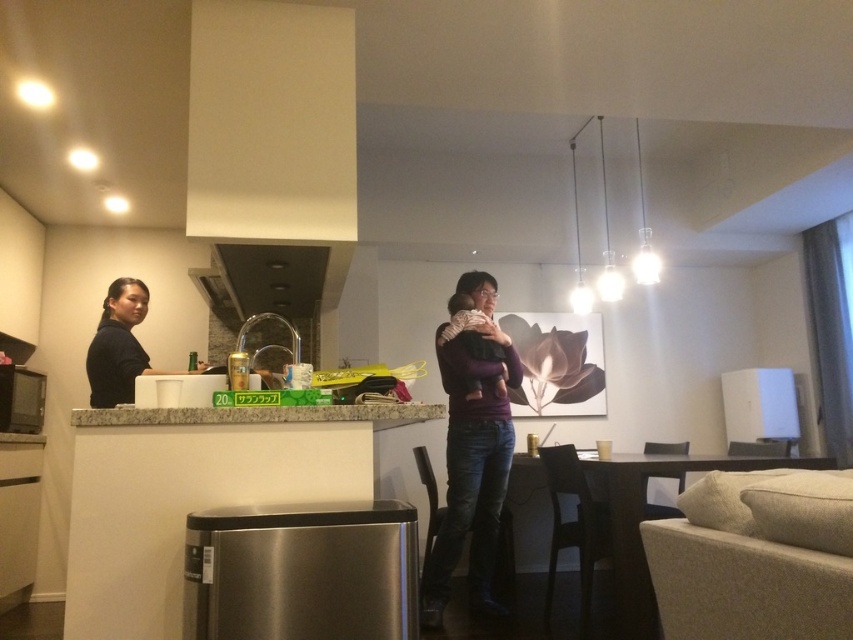
Question: Does granite countertop at center appear on the left side of black matte shirt at upper left?

Choices:
 (A) yes
 (B) no

Answer: (B)

Question: Can you confirm if black matte exhaust hood at upper center is wider than granite countertop at center?

Choices:
 (A) yes
 (B) no

Answer: (B)

Question: Does black matte exhaust hood at upper center have a smaller size compared to black matte shirt at upper left?

Choices:
 (A) yes
 (B) no

Answer: (B)

Question: Estimate the real-world distances between objects in this image. Which object is farther from the black matte exhaust hood at upper center?

Choices:
 (A) black matte shirt at upper left
 (B) granite countertop at center
 (C) dark purple sweater at center

Answer: (C)

Question: Which object appears closest to the camera in this image?

Choices:
 (A) dark purple sweater at center
 (B) black matte exhaust hood at upper center
 (C) black matte shirt at upper left
 (D) granite countertop at center

Answer: (D)

Question: Estimate the real-world distances between objects in this image. Which object is closer to the granite countertop at center?

Choices:
 (A) dark purple sweater at center
 (B) black matte shirt at upper left
 (C) black matte exhaust hood at upper center

Answer: (C)